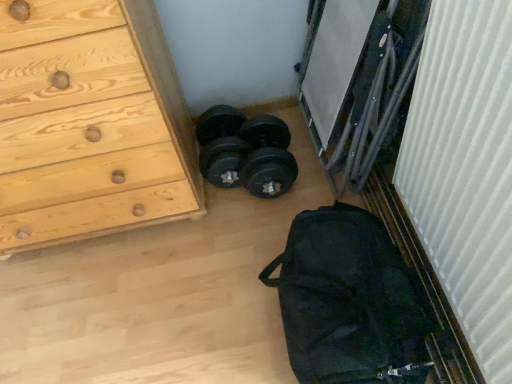
Locate an element on the screen. This screenshot has height=384, width=512. vacant space in front of black rubber dumbbells at center is located at coordinates (247, 231).